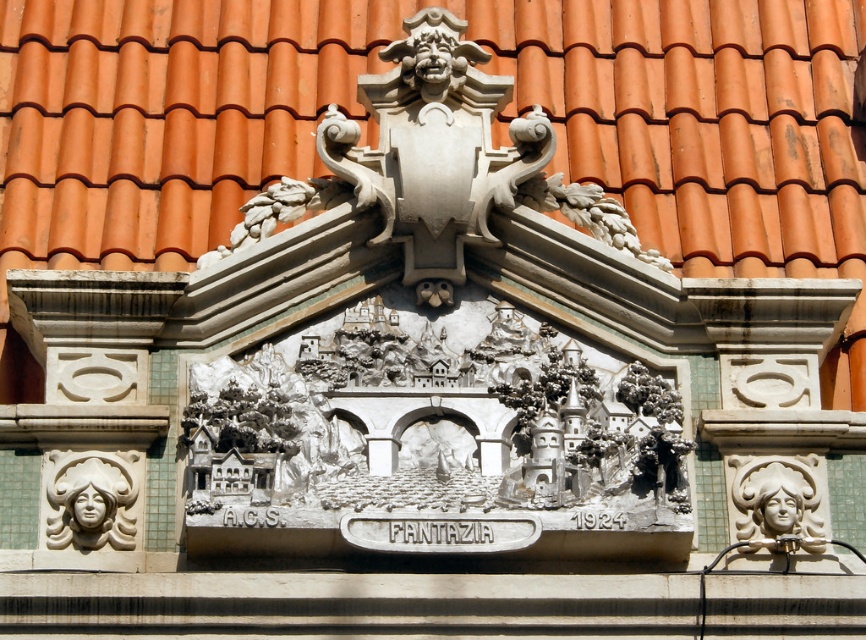
You are an art conservator examining the decorative facade. You notice the white stone face at center and the white glossy sculpture at right. Which object is closer to the viewer?

The white stone face at center is closer to the viewer because it is in front of the white glossy sculpture at right.

You are an architect inspecting the facade. You notice the orange clay tiles at center and the white stone face at center. Which object would cast a bigger shadow if the sun is directly above them?

The orange clay tiles at center has a larger size compared to the white stone face at center, so it would cast a bigger shadow.

You are an architect inspecting the building facade. You notice the orange clay tiles at center and the white stone face at center. Which object is positioned higher in the structure?

The orange clay tiles at center are positioned higher than the white stone face at center because the description states that the orange clay tiles at center is located above white stone face at center.